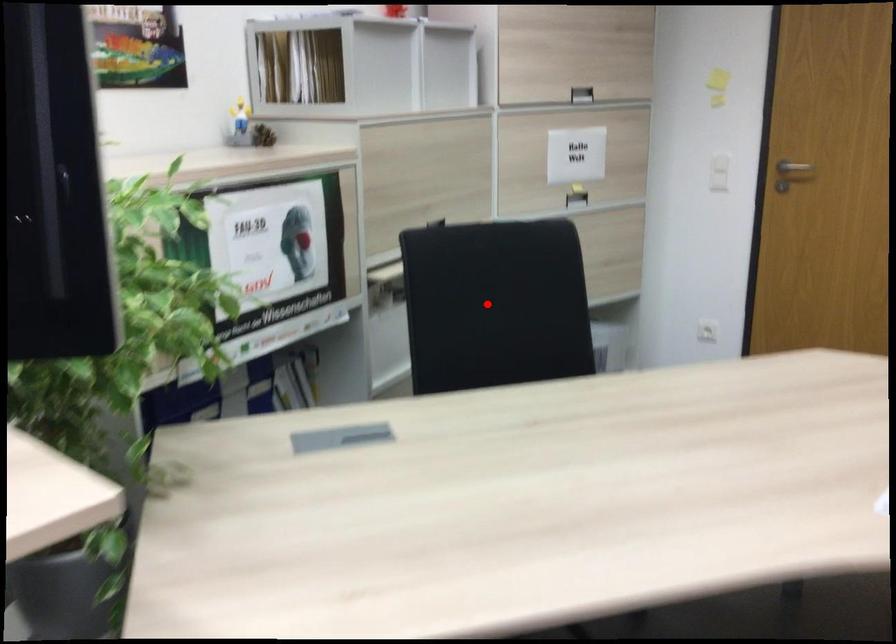
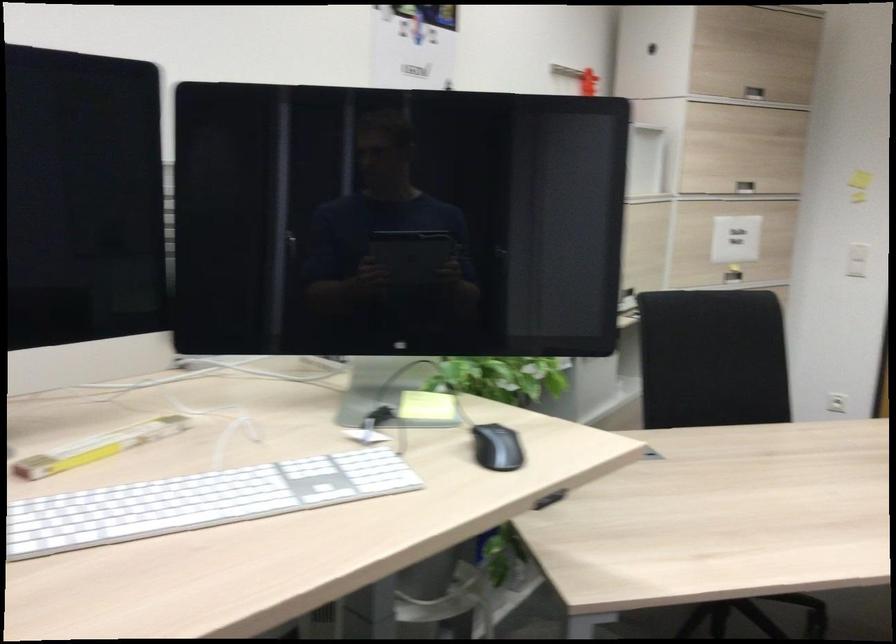
Question: I am providing you with two images of the same scene from different viewpoints. Given a red point in image1, look at the same physical point in image2. Is it:

Choices:
 (A) Closer to the viewpoint
 (B) Farther from the viewpoint

Answer: (B)